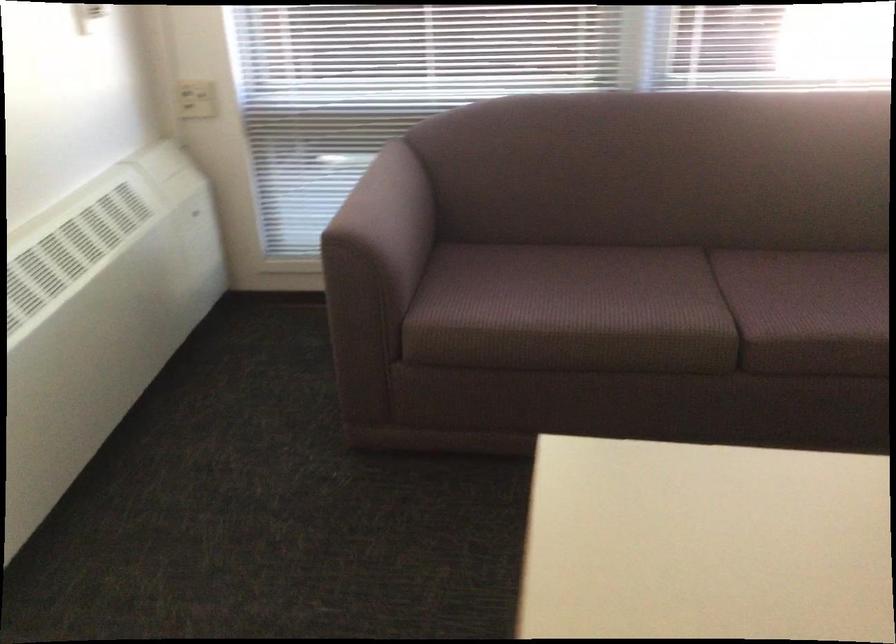
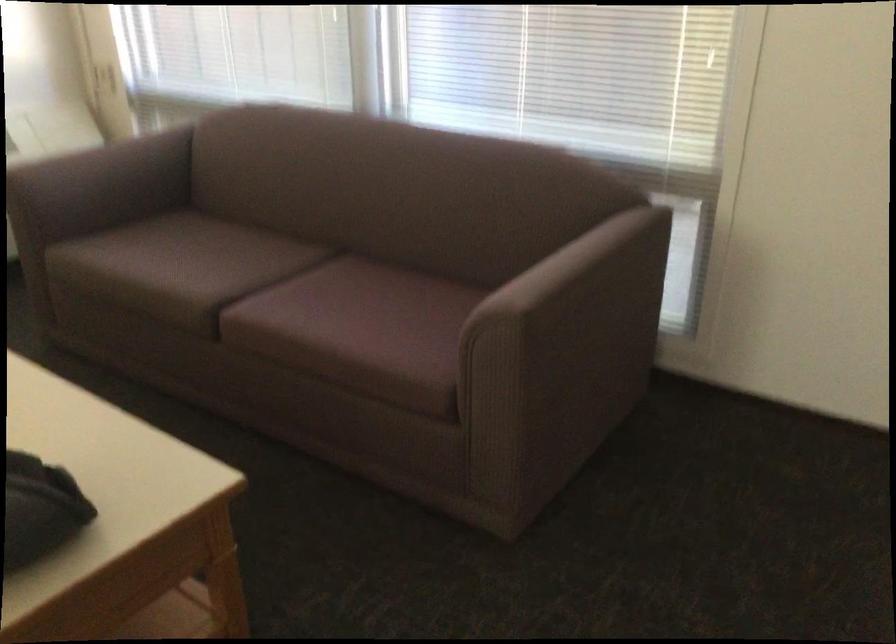
Locate, in the second image, the point that corresponds to (x=788, y=308) in the first image.

(277, 299)